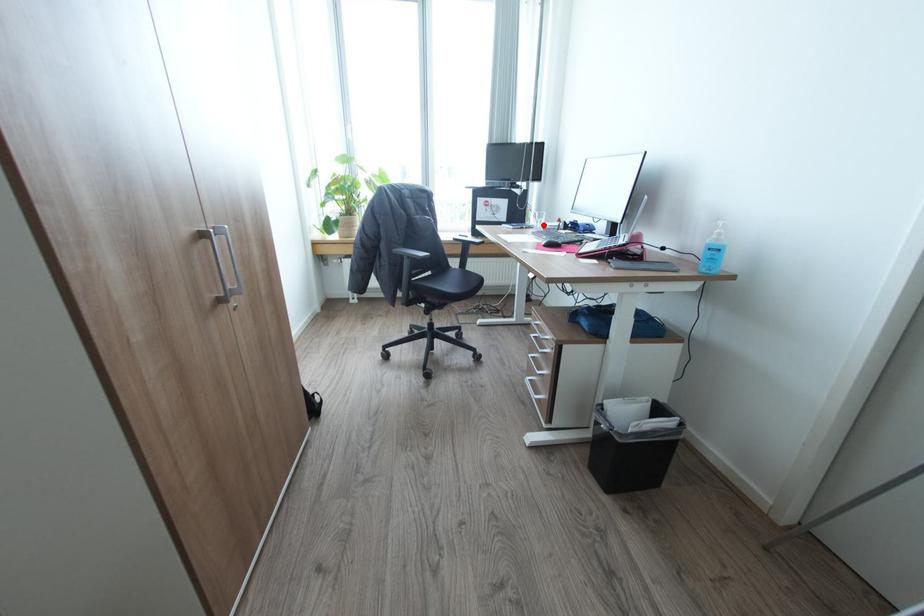
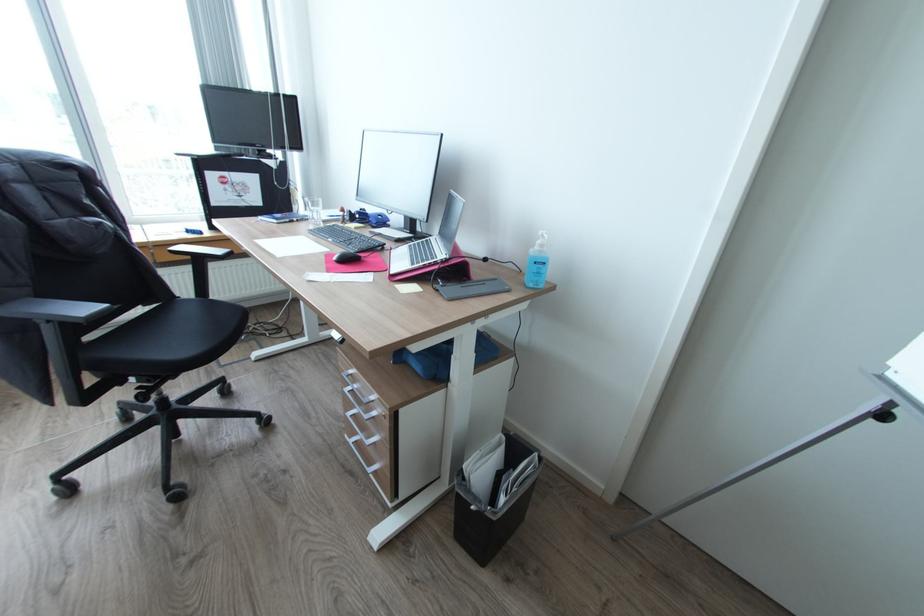
Locate, in the second image, the point that corresponds to the highlighted location in the first image.

(321, 217)